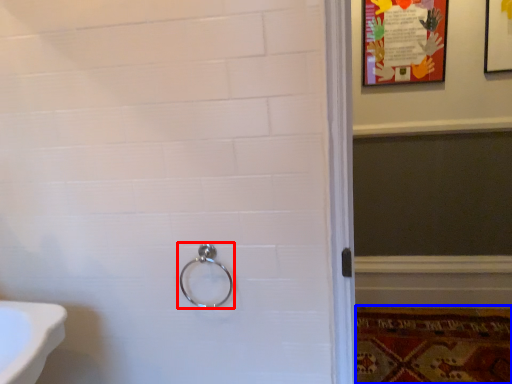
Question: Which of the following is the farthest to the observer, door handle (highlighted by a red box) or mat (highlighted by a blue box)?

Choices:
 (A) door handle
 (B) mat

Answer: (B)